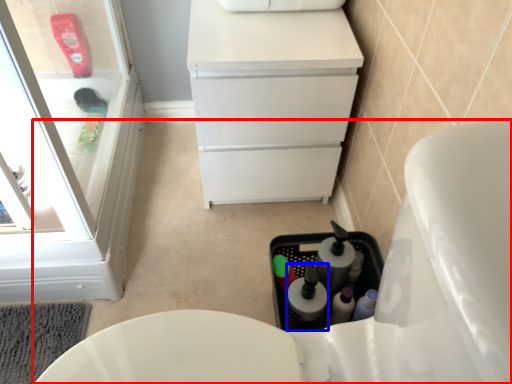
Question: Which object is further to the camera taking this photo, toilet (highlighted by a red box) or bottle (highlighted by a blue box)?

Choices:
 (A) toilet
 (B) bottle

Answer: (B)